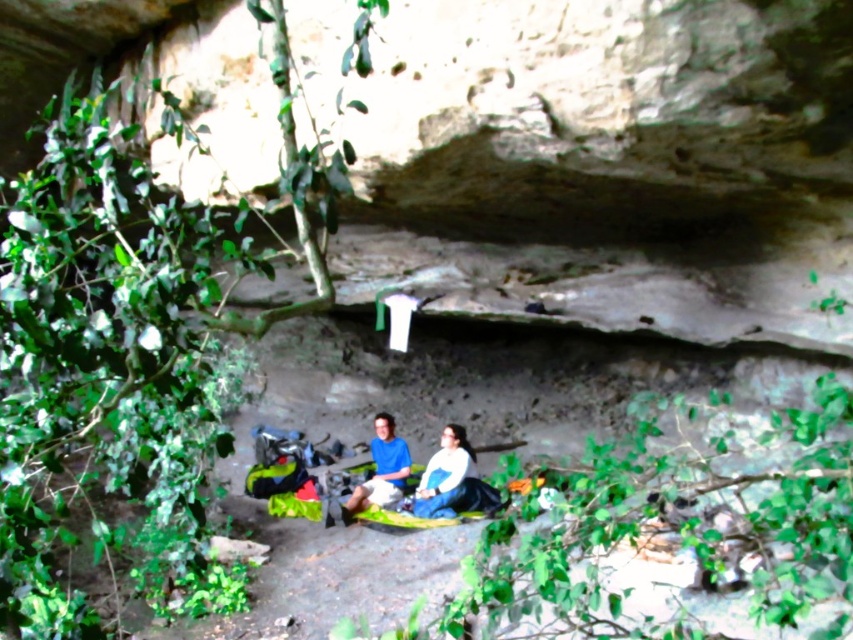
You are planning to take a photo of the two people sitting on the blanket. You want to ensure both the white matte jacket at center and the matte blue shirt at center are clearly visible. Which person should you position closer to the left side of the frame to achieve this?

The white matte jacket at center is positioned on the right side of the matte blue shirt at center. To ensure both are clearly visible, position the person in the matte blue shirt at center closer to the left side of the frame so the white matte jacket at center remains on their right, keeping them both within the frame.

You are planning to take a photo of the two people sitting on the blanket in the cave. Which of the two people, the one wearing the white matte jacket at center or the one in the matte blue shirt at center, is positioned higher up in the frame?

The white matte jacket at center is above the matte blue shirt at center, so the person wearing the white matte jacket at center is positioned higher up in the frame.